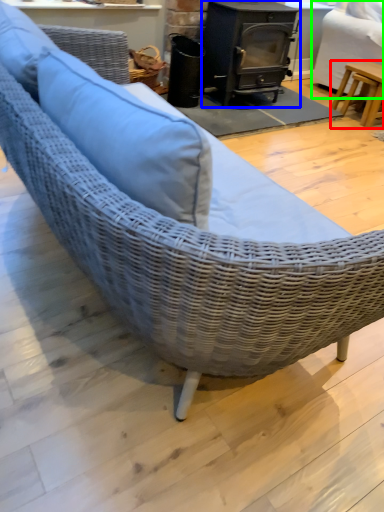
Question: Which object is positioned farthest from table (highlighted by a red box)? Select from wood burning stove (highlighted by a blue box) and swivel chair (highlighted by a green box).

Choices:
 (A) wood burning stove
 (B) swivel chair

Answer: (A)